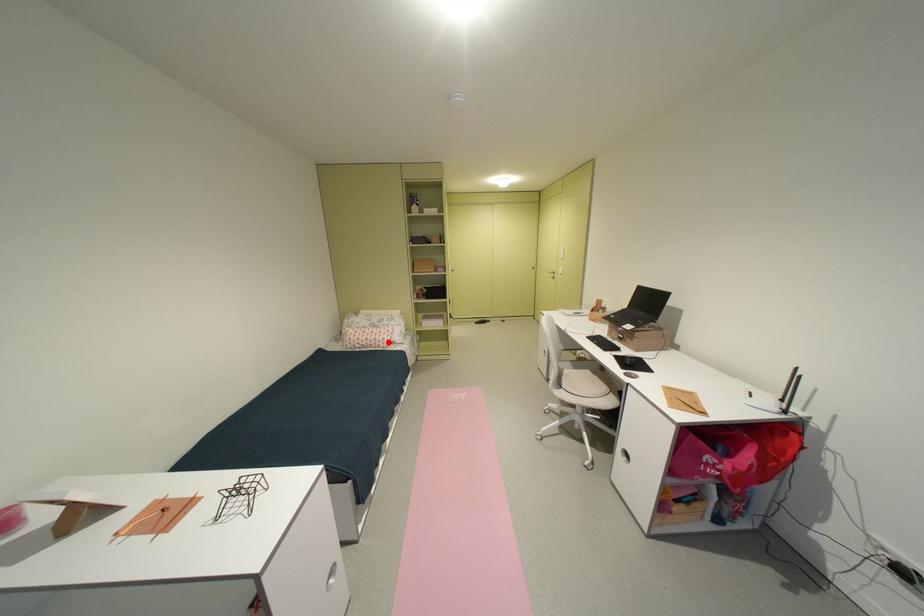
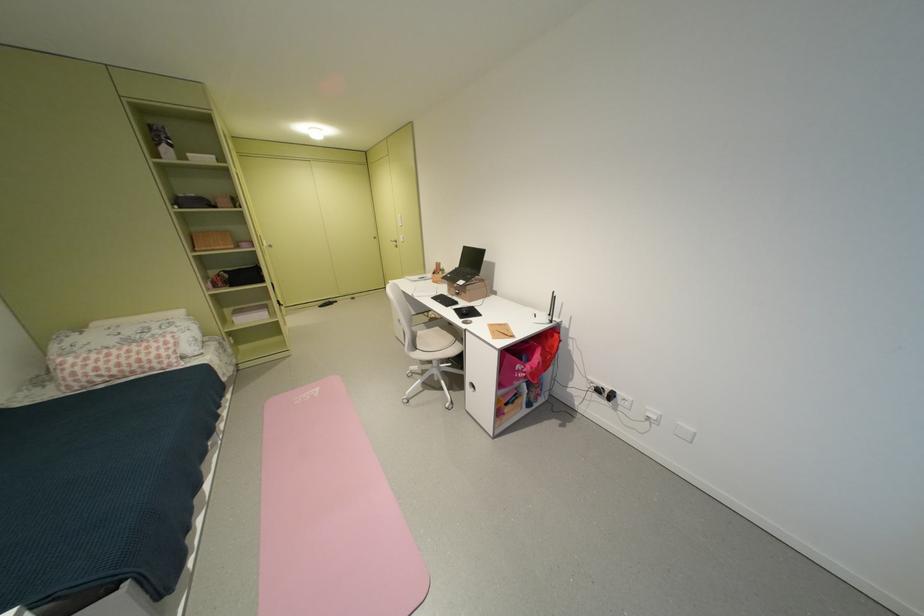
The point at the highlighted location is marked in the first image. Where is the corresponding point in the second image?

(159, 362)